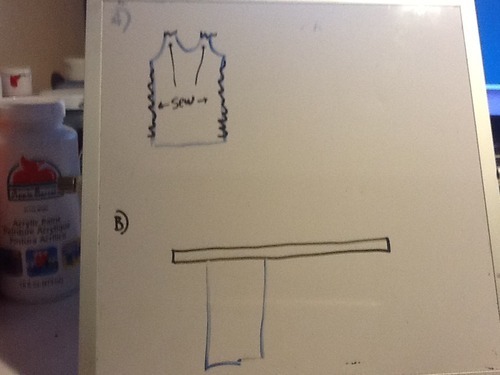
The height and width of the screenshot is (375, 500). I want to click on gray border on left side of board, so click(x=89, y=136).